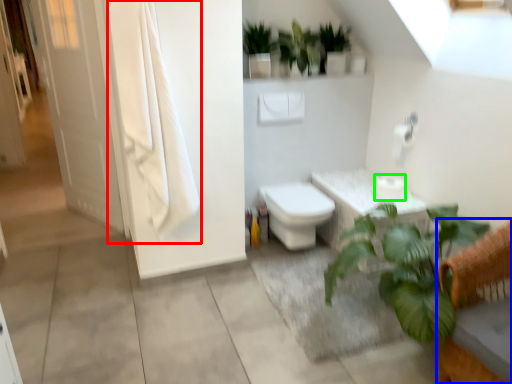
Question: Considering the real-world distances, which object is closest to curtain (highlighted by a red box)? furniture (highlighted by a blue box) or toilet paper (highlighted by a green box).

Choices:
 (A) furniture
 (B) toilet paper

Answer: (B)